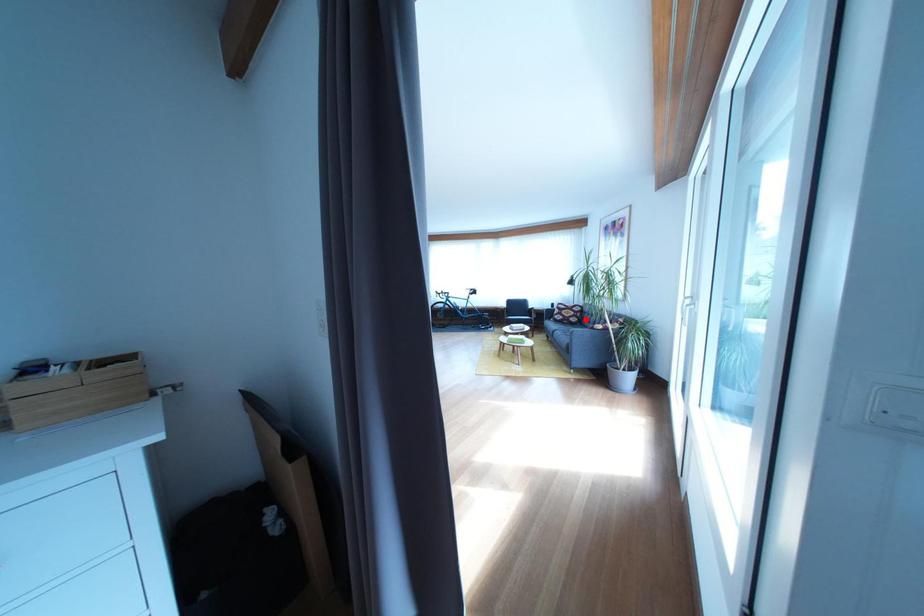
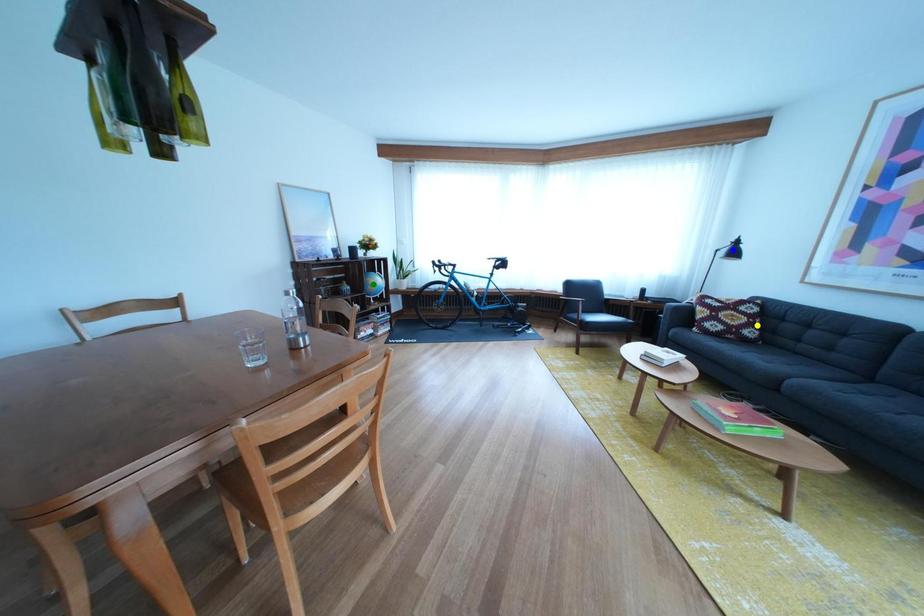
Question: I am providing you with two images of the same scene from different viewpoints. A red point is marked on the first image. You are given multiple points on the second image. Which point in image 2 is actually the same real-world point as the red point in image 1?

Choices:
 (A) green point
 (B) blue point
 (C) yellow point

Answer: (C)